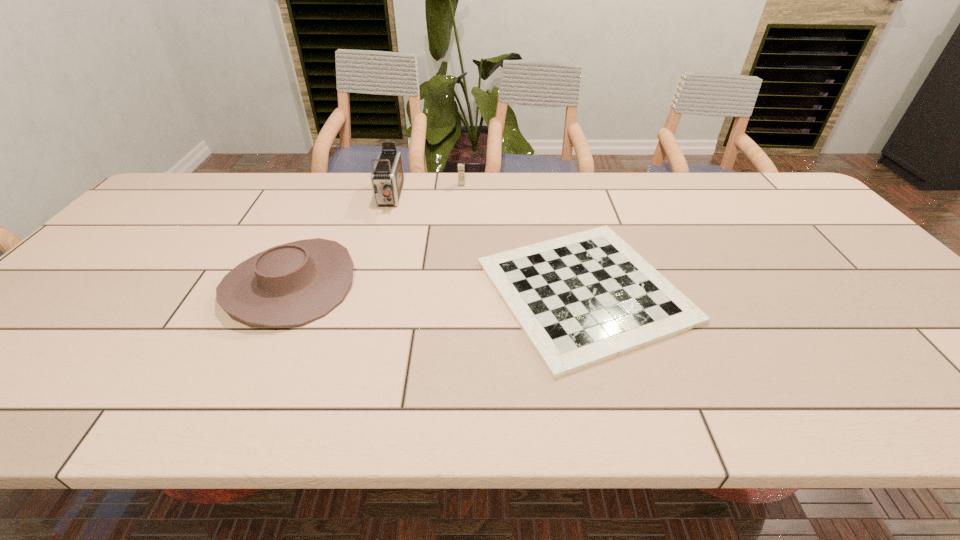
This screenshot has height=540, width=960. I want to click on free point between the checkerboard and the cellular telephone, so click(x=523, y=238).

Where is `free space between the tallest object and the third tallest object`? Image resolution: width=960 pixels, height=540 pixels. free space between the tallest object and the third tallest object is located at coordinates (340, 240).

Find the location of a particular element. The image size is (960, 540). unoccupied area between the third object from left to right and the camcorder is located at coordinates (425, 191).

Locate an element on the screen. The height and width of the screenshot is (540, 960). free spot between the third tallest object and the third shortest object is located at coordinates (376, 235).

Where is `empty space between the cellular telephone and the camcorder`? empty space between the cellular telephone and the camcorder is located at coordinates (425, 191).

Select which object appears as the second closest to the third tallest object. Please provide its 2D coordinates. Your answer should be formatted as a tuple, i.e. [(x, y)], where the tuple contains the x and y coordinates of a point satisfying the conditions above.

[(580, 299)]

Select which object appears as the second closest to the cowboy hat. Please provide its 2D coordinates. Your answer should be formatted as a tuple, i.e. [(x, y)], where the tuple contains the x and y coordinates of a point satisfying the conditions above.

[(580, 299)]

Locate an element on the screen. This screenshot has height=540, width=960. vacant space that satisfies the following two spatial constraints: 1. at the lens of the tallest object; 2. on the right side of the rightmost object is located at coordinates (362, 291).

The width and height of the screenshot is (960, 540). Identify the location of vacant space that satisfies the following two spatial constraints: 1. at the lens of the camcorder; 2. on the right side of the shortest object. (362, 291).

This screenshot has width=960, height=540. I want to click on free space that satisfies the following two spatial constraints: 1. at the lens of the camcorder; 2. on the left side of the rightmost object, so click(x=362, y=291).